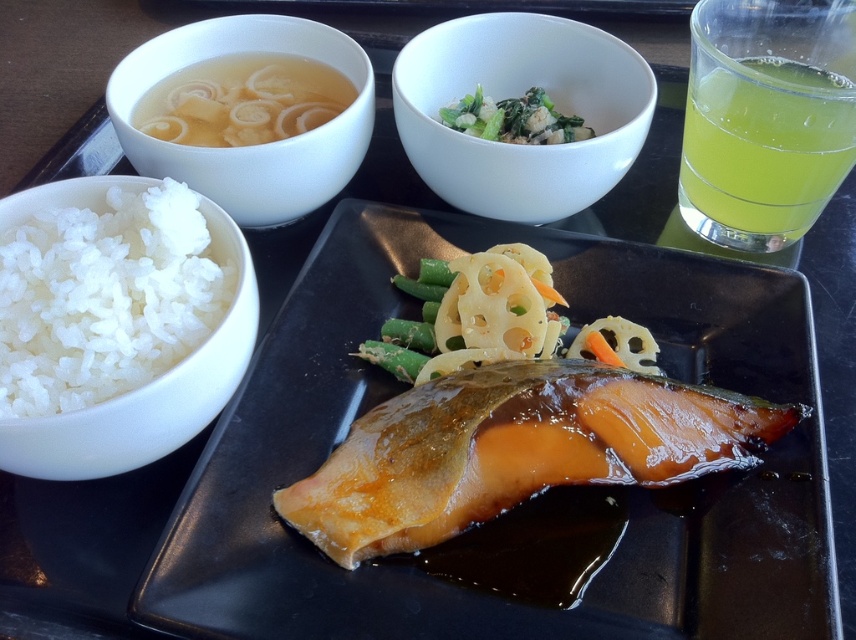
Who is more distant from viewer, (390, 220) or (355, 74)?

Point (355, 74)

Who is shorter, glossy ceramic platter at lower left or translucent glass bowl at upper left?

translucent glass bowl at upper left

What do you see at coordinates (522, 502) in the screenshot? The height and width of the screenshot is (640, 856). I see `glossy ceramic platter at lower left` at bounding box center [522, 502].

Find the location of a particular element. The width and height of the screenshot is (856, 640). glossy ceramic platter at lower left is located at coordinates (522, 502).

Which is below, glossy ceramic platter at lower left or translucent yellow liquid at upper right?

glossy ceramic platter at lower left is below.

Is glossy ceramic platter at lower left positioned at the back of translucent yellow liquid at upper right?

No.

Is point (146, 608) farther from camera compared to point (727, 188)?

No, it is not.

The image size is (856, 640). I want to click on glossy ceramic platter at lower left, so click(x=522, y=502).

Does point (749, 140) lie in front of point (137, 428)?

No.

Which is below, translucent yellow liquid at upper right or white matte rice bowl at left?

white matte rice bowl at left is below.

Locate an element on the screen. The image size is (856, 640). translucent yellow liquid at upper right is located at coordinates (762, 152).